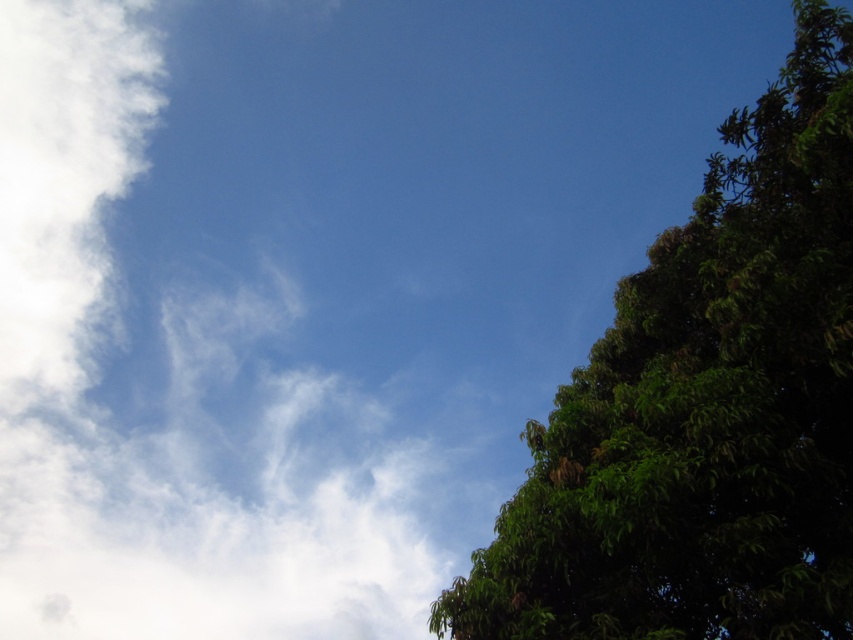
You are a photographer trying to capture a closeup of the sky while standing in front of the dense green foliage. You notice two points in the scene labeled as point (292, 579) and point (650, 397). Which point should you focus on to ensure the sky is in focus?

You should focus on point (292, 579) because it is closer to the camera than point (650, 397), allowing for a clearer closeup of the sky.

You are an artist painting the sky scene. You want to ensure the white fluffy cloud at upper left and the green leafy tree at right are proportionally accurate. Which object should you draw first to maintain the correct size relationship?

You should draw the white fluffy cloud at upper left first since it is wider than the green leafy tree at right, ensuring proper scaling before adding the smaller tree.